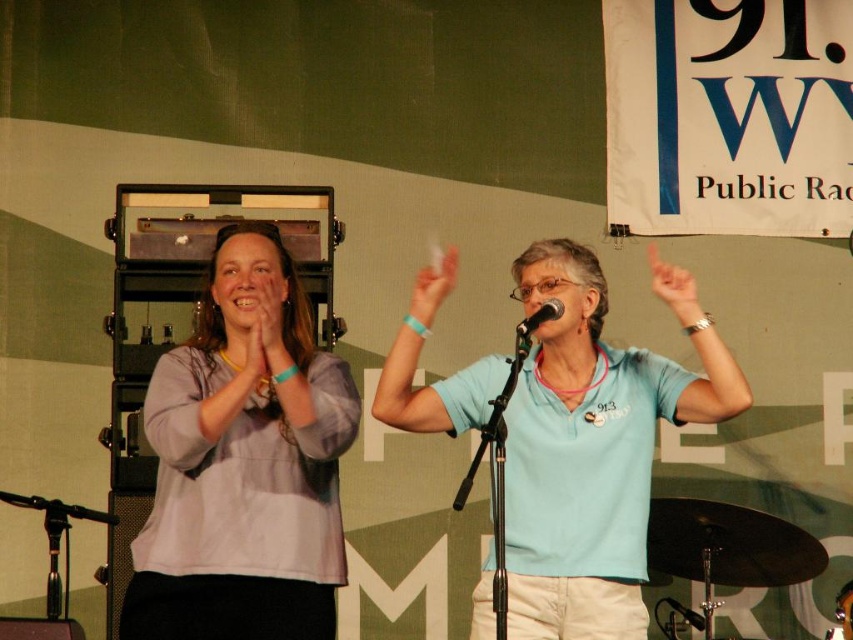
Question: Which object is positioned closest to the black matte microphone at center?

Choices:
 (A) matte gray shirt at center
 (B) light blue fabric shirt at center
 (C) white matte hand at center

Answer: (C)

Question: Is light blue fabric shirt at center positioned before black matte microphone at center?

Choices:
 (A) no
 (B) yes

Answer: (B)

Question: Estimate the real-world distances between objects in this image. Which object is farther from the white matte hand at center?

Choices:
 (A) black matte microphone at center
 (B) light gray cotton shirt at center
 (C) matte skin finger at upper right
 (D) matte gray shirt at center

Answer: (C)

Question: Does matte skin finger at upper right have a greater width compared to matte gray shirt at center?

Choices:
 (A) no
 (B) yes

Answer: (B)

Question: Which point is farther to the camera?

Choices:
 (A) (686, 282)
 (B) (450, 257)
 (C) (537, 576)

Answer: (B)

Question: Can you confirm if light gray cotton shirt at center is wider than light blue fabric shirt at center?

Choices:
 (A) yes
 (B) no

Answer: (B)